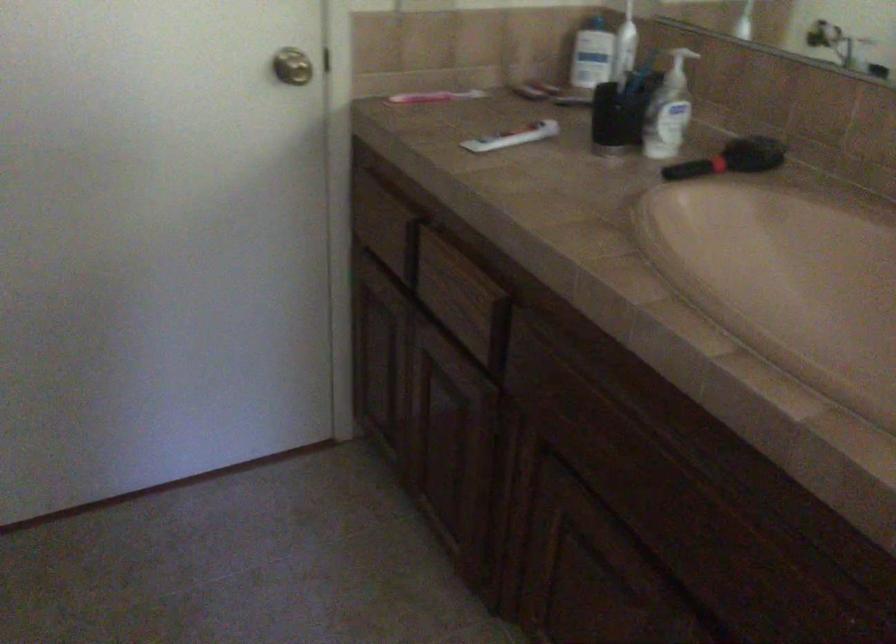
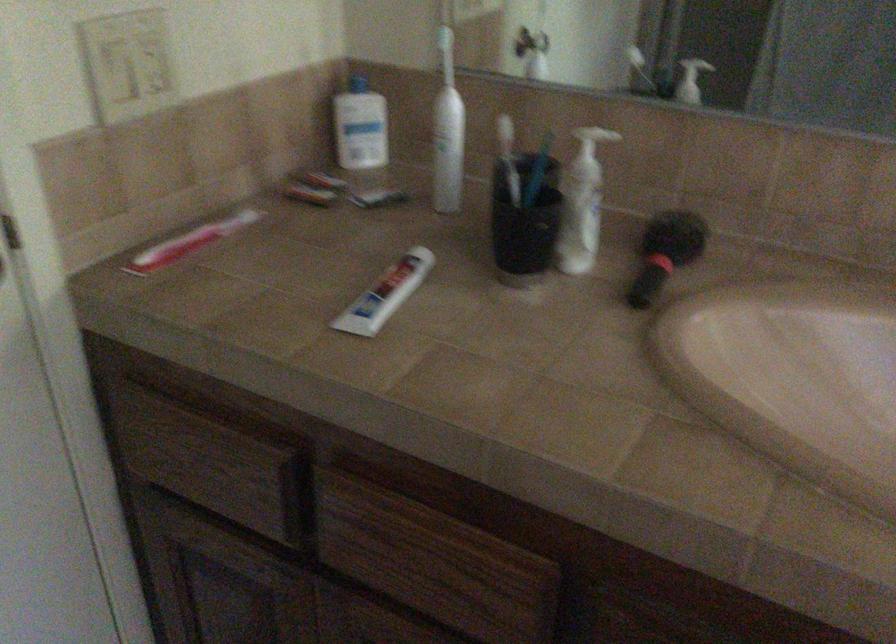
Find the pixel in the second image that matches the point at 375,216 in the first image.

(195, 456)